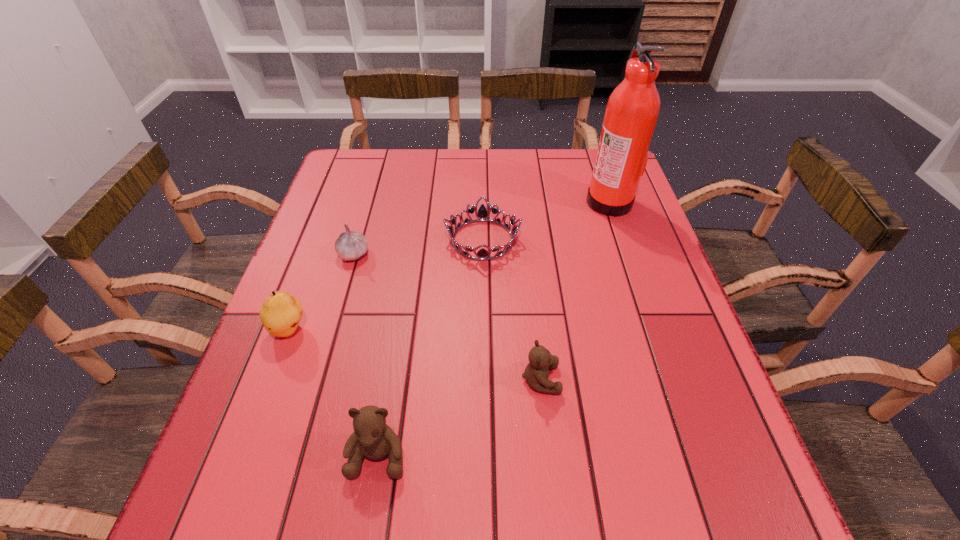
Find the location of `object present at the near edge`. object present at the near edge is located at coordinates (372, 437).

Identify the location of garlic located in the left edge section of the desktop. Image resolution: width=960 pixels, height=540 pixels. coord(351,245).

Where is `pear that is at the left edge`? The height and width of the screenshot is (540, 960). pear that is at the left edge is located at coordinates (281, 312).

Find the location of a particular element. This screenshot has width=960, height=540. object at the right edge is located at coordinates (632, 110).

The height and width of the screenshot is (540, 960). Find the location of `object located in the far right corner section of the desktop`. object located in the far right corner section of the desktop is located at coordinates (632, 110).

Locate an element on the screen. This screenshot has height=540, width=960. vacant area at the far edge of the desktop is located at coordinates (565, 174).

At what (x,y) coordinates should I click in order to perform the action: click on free space at the near edge. Please return your answer as a coordinate pair (x, y). Looking at the image, I should click on (568, 414).

Where is `vacant space at the left edge of the desktop`? This screenshot has width=960, height=540. vacant space at the left edge of the desktop is located at coordinates (326, 306).

In the image, there is a desktop. Identify the location of vacant space at the right edge. This screenshot has width=960, height=540. (683, 330).

I want to click on free space at the far left corner, so click(372, 174).